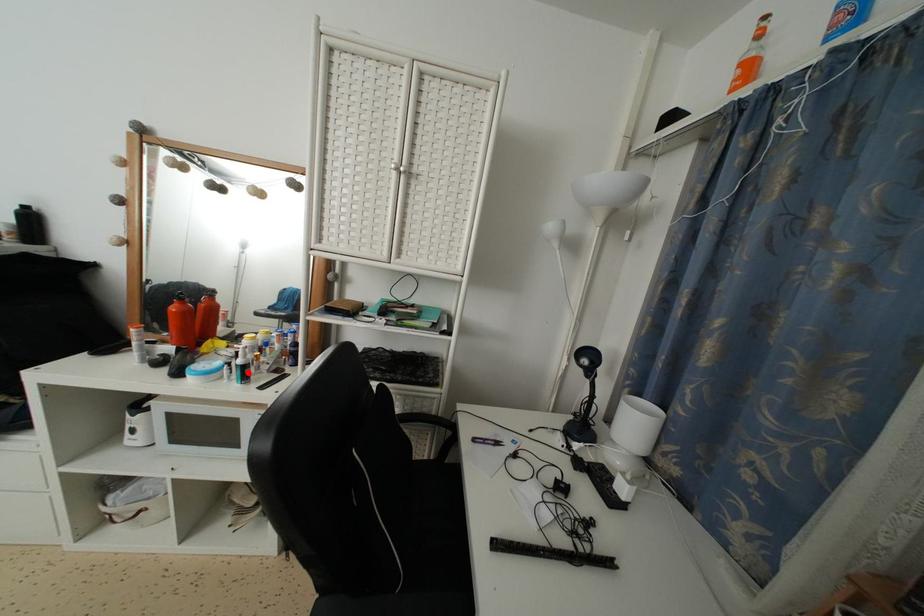
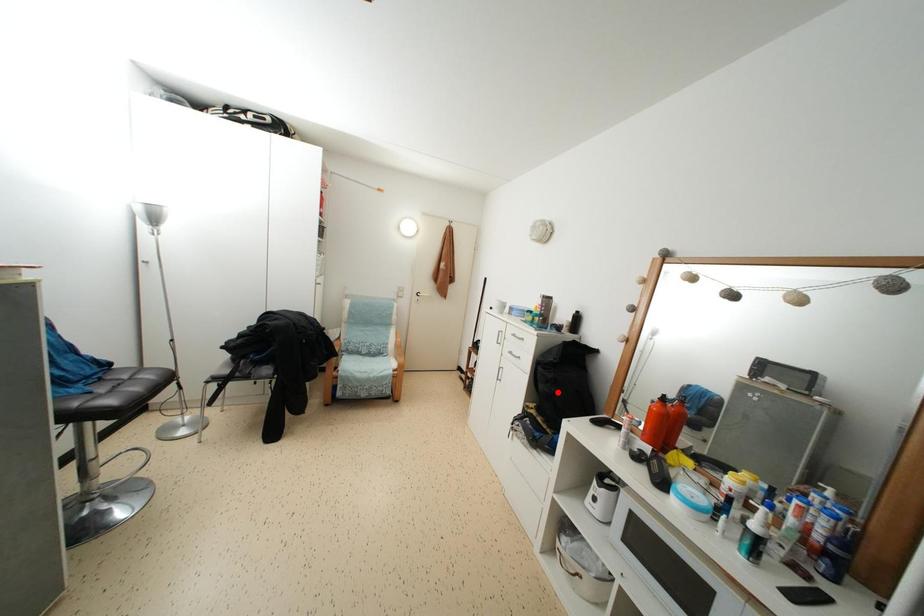
I am providing you with two images of the same scene from different viewpoints. A red point is marked on the first image and another point is marked on the second image. Does the point marked in image1 correspond to the same location as the one in image2?

No